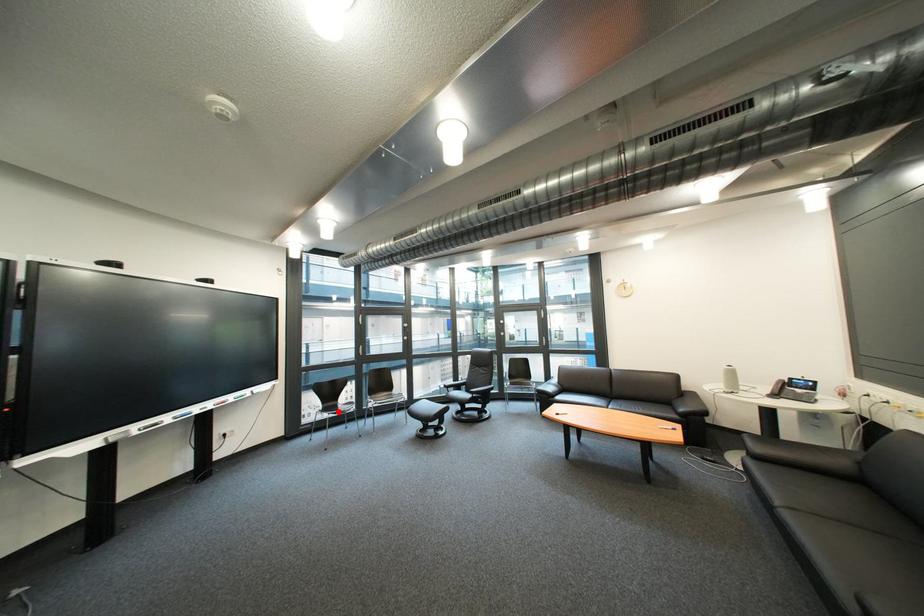
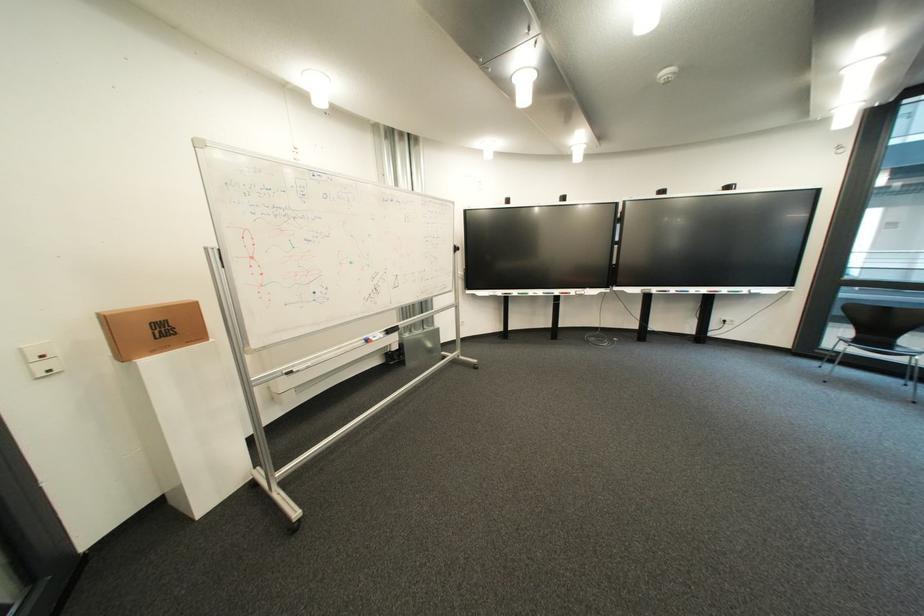
In the second image, find the point that corresponds to the highlighted location in the first image.

(870, 342)